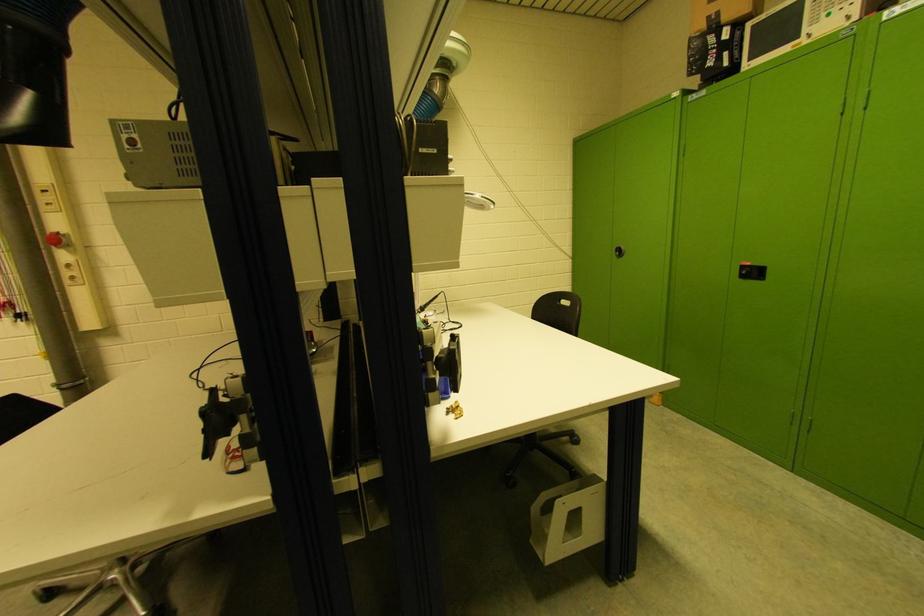
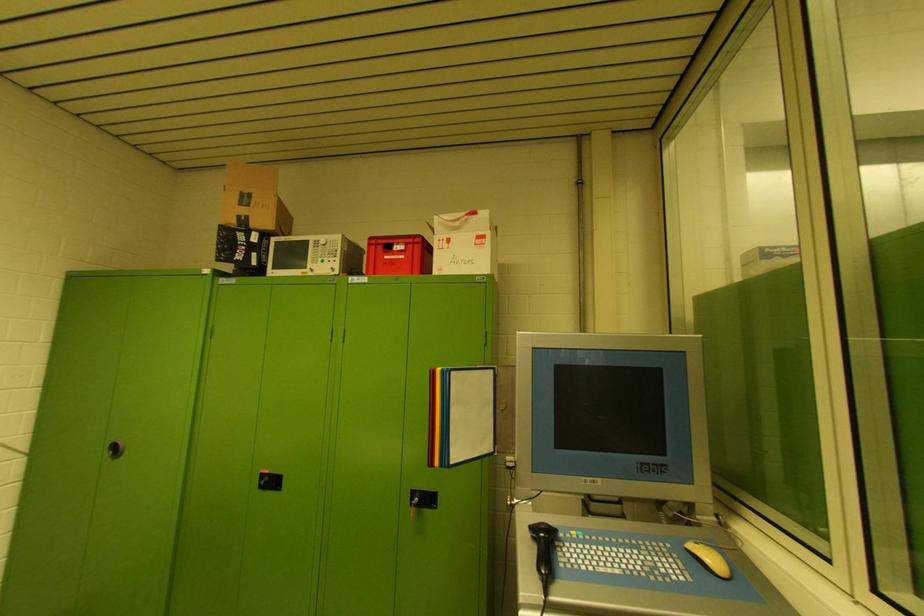
First-person continuous shooting, in which direction is the camera rotating?

The camera rotated toward right-up.